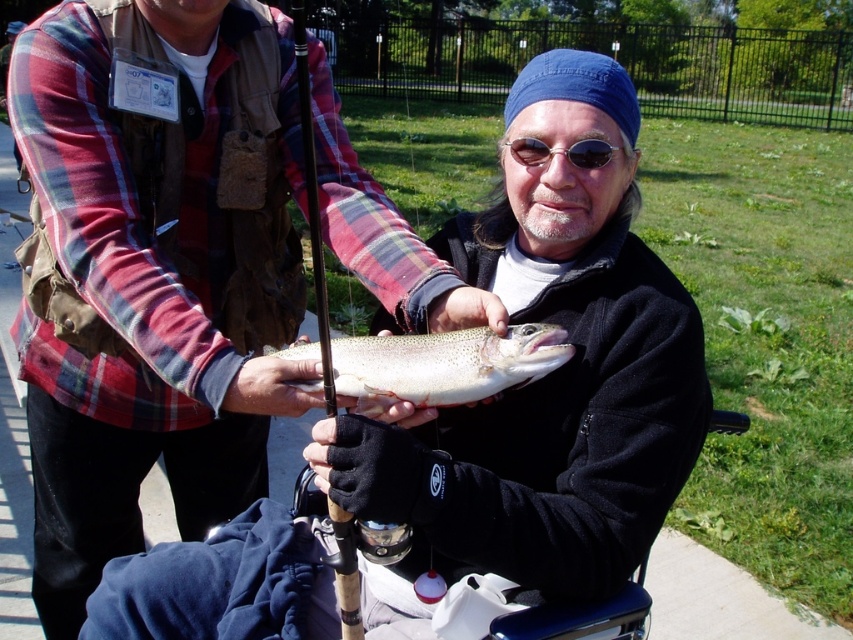
Question: Which is nearer to the sunglasses at center?

Choices:
 (A) shiny silver fish at center
 (B) shiny silver spoon at upper center

Answer: (A)

Question: Does shiny silver spoon at upper center appear under sunglasses at center?

Choices:
 (A) no
 (B) yes

Answer: (B)

Question: Is the position of shiny silver spoon at upper center more distant than that of wooden fishing pole at center?

Choices:
 (A) yes
 (B) no

Answer: (A)

Question: Among these points, which one is farthest from the camera?

Choices:
 (A) (416, 349)
 (B) (67, 13)

Answer: (B)

Question: Can you confirm if wooden fishing pole at center is positioned below sunglasses at center?

Choices:
 (A) yes
 (B) no

Answer: (B)

Question: Which object is the farthest from the wooden fishing pole at center?

Choices:
 (A) sunglasses at center
 (B) shiny silver fish at center

Answer: (A)